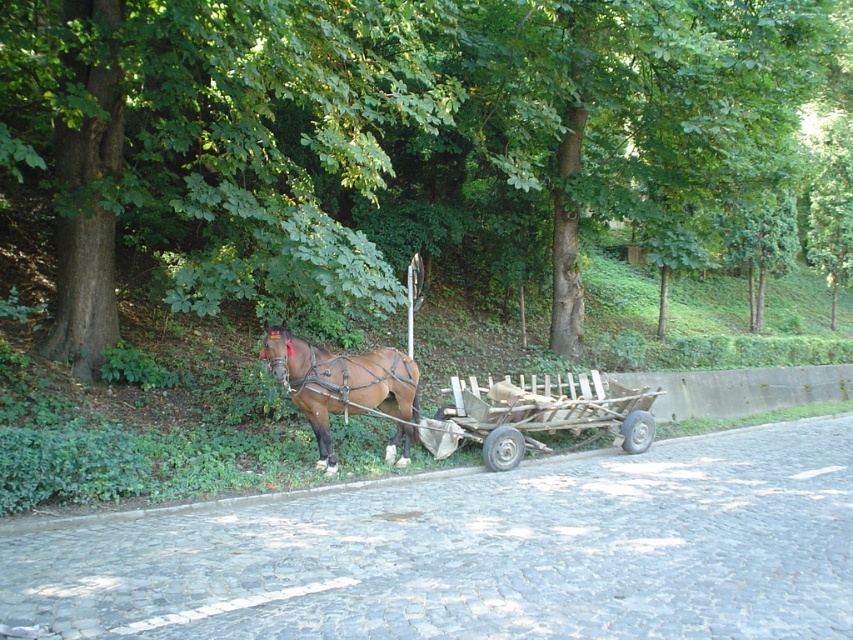
Consider the image. You are a farmer standing on the cobblestone road and want to load some hay onto the wooden planks cart at lower right. The brown glossy horse at center is blocking your path. Which direction should you move the horse to access the cart?

You should move the brown glossy horse at center to the left to access the wooden planks cart at lower right since the cart is to the right of the horse.

You are standing at the center of the image. Which direction should you move to reach the wooden planks cart at lower right?

The wooden planks cart at lower right is located at point (x=544, y=412) in 2D coordinates, so you should move towards the lower right direction to reach it.

You are a traveler standing on the cobblestone road and see the brown wood tree at upper left and the brown glossy horse at center. Which object is located to the right of the other?

The brown wood tree at upper left is positioned on the right side of brown glossy horse at center, so the brown wood tree at upper left is to the right of the brown glossy horse at center.